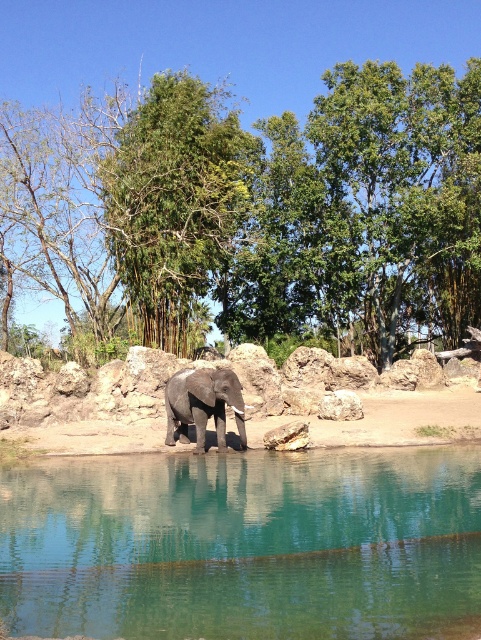
You are an ornithologist observing the scene. You notice two green leafy trees in the image. Which tree, the green leafy tree at center or the green leafy tree at upper center, is taller?

The green leafy tree at center is taller than the green leafy tree at upper center.

You are a bird flying over the scene. You want to land on the green leafy tree at center and the clear glass water at center. Which one is closer to your left side when facing the direction of flight?

The green leafy tree at center is to the left of clear glass water at center, so when facing the direction of flight, the green leafy tree at center would be closer to your left side.

You are an ornithologist observing the scene. You need to determine which object is taller between the green leafy tree at center and the clear glass water at center. Which one is taller?

The green leafy tree at center has a greater height compared to the clear glass water at center, so the green leafy tree at center is taller.